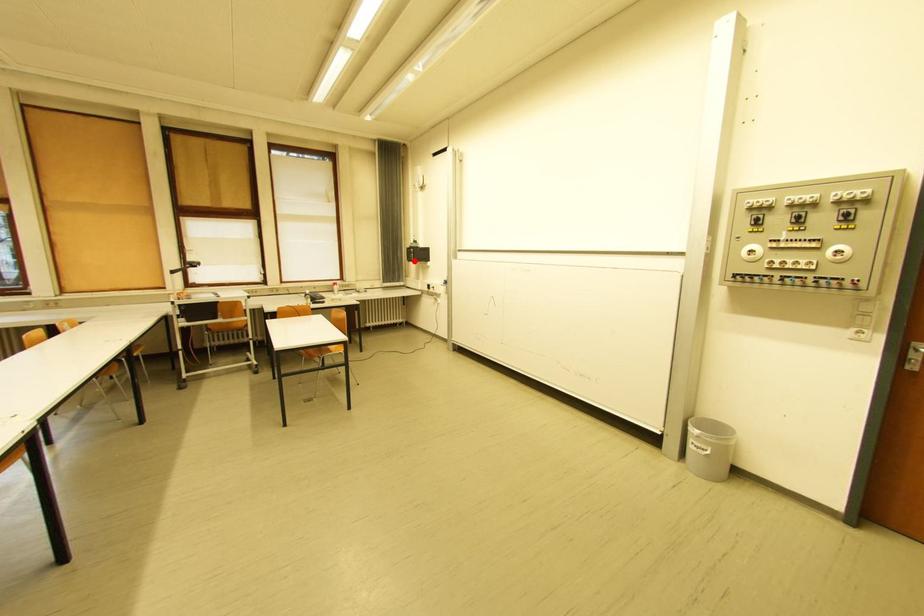
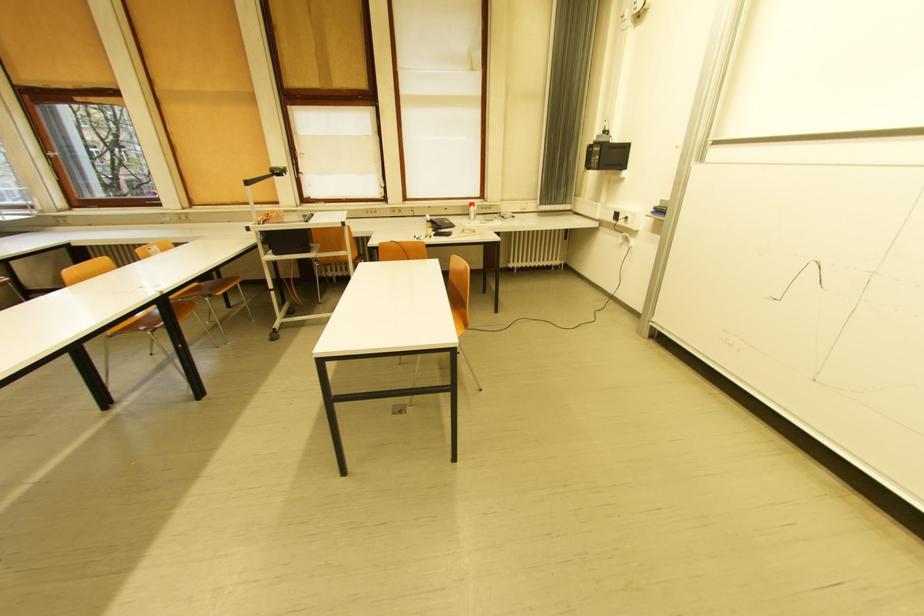
The point at the highlighted location is marked in the first image. Where is the corresponding point in the second image?

(592, 168)